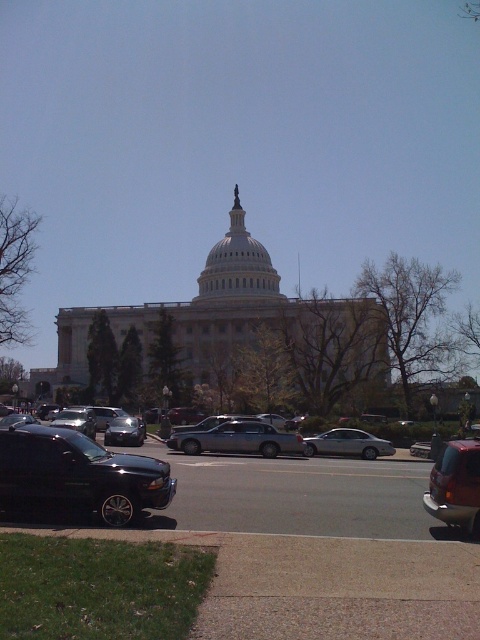
Question: Is silver metallic station wagon at center below silver metallic sedan at center?

Choices:
 (A) no
 (B) yes

Answer: (A)

Question: Which point is closer to the camera?

Choices:
 (A) shiny black sedan at center
 (B) metallic red suv at right
 (C) silver metallic sedan at center

Answer: (B)

Question: Does shiny black sedan at center have a larger size compared to metallic red suv at right?

Choices:
 (A) yes
 (B) no

Answer: (A)

Question: Which of these objects is positioned closest to the metallic red suv at right?

Choices:
 (A) silver metallic station wagon at center
 (B) shiny black sedan at center

Answer: (B)

Question: From the image, what is the correct spatial relationship of shiny black suv at lower left in relation to silver metallic sedan at center?

Choices:
 (A) right
 (B) left

Answer: (B)

Question: Among these objects, which one is nearest to the camera?

Choices:
 (A) metallic red suv at right
 (B) silver metallic sedan at center
 (C) silver metallic station wagon at center
 (D) shiny black sedan at center

Answer: (A)